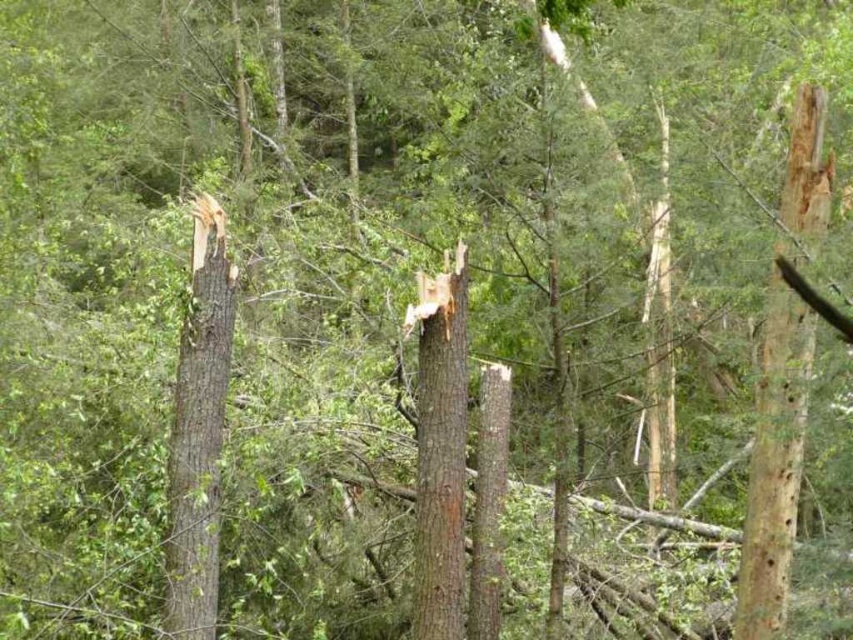
Is smooth brown tree trunk at left taller than brown rough tree trunk at center?

Correct, smooth brown tree trunk at left is much taller as brown rough tree trunk at center.

Does smooth brown tree trunk at left have a larger size compared to brown rough tree trunk at center?

Yes.

Image resolution: width=853 pixels, height=640 pixels. Describe the element at coordinates (198, 429) in the screenshot. I see `smooth brown tree trunk at left` at that location.

Where is `smooth brown tree trunk at left`? The height and width of the screenshot is (640, 853). smooth brown tree trunk at left is located at coordinates (198, 429).